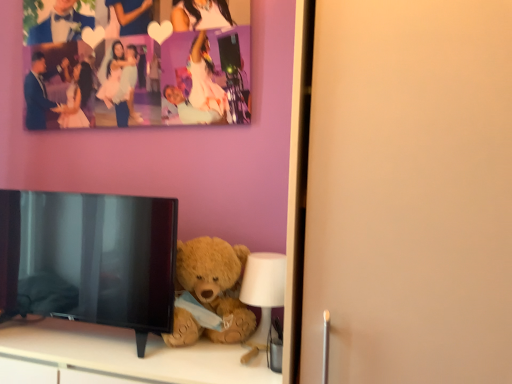
Identify the location of white plastic lamp at lower center. This screenshot has width=512, height=384. (262, 294).

Describe the element at coordinates (211, 291) in the screenshot. I see `fuzzy brown teddy bear at lower center` at that location.

What do you see at coordinates (118, 356) in the screenshot? This screenshot has width=512, height=384. I see `soft beige teddy bear at lower center` at bounding box center [118, 356].

The height and width of the screenshot is (384, 512). Find the location of `soft beige teddy bear at lower center`. soft beige teddy bear at lower center is located at coordinates (118, 356).

Identify the location of white plastic lamp at lower center. tap(262, 294).

Between soft beige teddy bear at lower center and black glossy tv at lower left, which one has larger width?

soft beige teddy bear at lower center.

From a real-world perspective, does soft beige teddy bear at lower center stand above black glossy tv at lower left?

No, from a real-world perspective, soft beige teddy bear at lower center is not over black glossy tv at lower left

Is soft beige teddy bear at lower center directly adjacent to black glossy tv at lower left?

soft beige teddy bear at lower center is not next to black glossy tv at lower left, and they're not touching.

From the image's perspective, which is below, soft beige teddy bear at lower center or black glossy tv at lower left?

soft beige teddy bear at lower center appears lower in the image.

Between fuzzy brown teddy bear at lower center and white plastic lamp at lower center, which one appears on the left side from the viewer's perspective?

From the viewer's perspective, fuzzy brown teddy bear at lower center appears more on the left side.

How far apart are fuzzy brown teddy bear at lower center and white plastic lamp at lower center?

fuzzy brown teddy bear at lower center and white plastic lamp at lower center are 4.06 inches apart.

Does point (218, 339) come farther from viewer compared to point (282, 306)?

No, (218, 339) is in front of (282, 306).

Is fuzzy brown teddy bear at lower center spatially inside white plastic lamp at lower center, or outside of it?

fuzzy brown teddy bear at lower center exists outside the volume of white plastic lamp at lower center.

Is fuzzy brown teddy bear at lower center closer to the viewer compared to soft beige teddy bear at lower center?

No, fuzzy brown teddy bear at lower center is further to the viewer.

Considering the sizes of objects fuzzy brown teddy bear at lower center and soft beige teddy bear at lower center in the image provided, who is wider, fuzzy brown teddy bear at lower center or soft beige teddy bear at lower center?

Wider between the two is soft beige teddy bear at lower center.

From the image's perspective, who appears lower, fuzzy brown teddy bear at lower center or soft beige teddy bear at lower center?

soft beige teddy bear at lower center appears lower in the image.

Considering the sizes of white plastic lamp at lower center and soft beige teddy bear at lower center in the image, is white plastic lamp at lower center wider or thinner than soft beige teddy bear at lower center?

In the image, white plastic lamp at lower center appears to be more narrow than soft beige teddy bear at lower center.

From the picture: Is white plastic lamp at lower center placed right next to soft beige teddy bear at lower center?

There is a gap between white plastic lamp at lower center and soft beige teddy bear at lower center.

From the image's perspective, is white plastic lamp at lower center located above or below soft beige teddy bear at lower center?

From the image's perspective, white plastic lamp at lower center appears above soft beige teddy bear at lower center.

From a real-world perspective, does white plastic lamp at lower center sit lower than soft beige teddy bear at lower center?

Incorrect, from a real-world perspective, white plastic lamp at lower center is higher than soft beige teddy bear at lower center.

Considering the sizes of objects soft beige teddy bear at lower center and fuzzy brown teddy bear at lower center in the image provided, who is taller, soft beige teddy bear at lower center or fuzzy brown teddy bear at lower center?

soft beige teddy bear at lower center.

Based on the photo, is soft beige teddy bear at lower center positioned far away from fuzzy brown teddy bear at lower center?

Actually, soft beige teddy bear at lower center and fuzzy brown teddy bear at lower center are a little close together.

Is soft beige teddy bear at lower center to the right of fuzzy brown teddy bear at lower center from the viewer's perspective?

In fact, soft beige teddy bear at lower center is to the left of fuzzy brown teddy bear at lower center.

Does black glossy tv at lower left have a greater height compared to soft beige teddy bear at lower center?

Indeed, black glossy tv at lower left has a greater height compared to soft beige teddy bear at lower center.

From a real-world perspective, is black glossy tv at lower left on top of soft beige teddy bear at lower center?

Yes, from a real-world perspective, black glossy tv at lower left is above soft beige teddy bear at lower center.

Is black glossy tv at lower left situated inside soft beige teddy bear at lower center or outside?

black glossy tv at lower left is outside soft beige teddy bear at lower center.

Does point (99, 202) come farther from viewer compared to point (70, 324)?

No, it is in front of (70, 324).

From the image's perspective, relative to black glossy tv at lower left, is fuzzy brown teddy bear at lower center above or below?

Based on their image positions, fuzzy brown teddy bear at lower center is located beneath black glossy tv at lower left.

Is fuzzy brown teddy bear at lower center to the right of black glossy tv at lower left from the viewer's perspective?

Yes.

Is fuzzy brown teddy bear at lower center facing towards black glossy tv at lower left?

No, fuzzy brown teddy bear at lower center does not turn towards black glossy tv at lower left.

Identify the location of furniture below the black glossy tv at lower left (from a real-world perspective). (118, 356).

At what (x,y) coordinates should I click in order to perform the action: click on lamp behind the fuzzy brown teddy bear at lower center. Please return your answer as a coordinate pair (x, y). Image resolution: width=512 pixels, height=384 pixels. Looking at the image, I should click on (262, 294).

From the image, which object appears to be nearer to black glossy tv at lower left, soft beige teddy bear at lower center or white plastic lamp at lower center?

soft beige teddy bear at lower center.

Estimate the real-world distances between objects in this image. Which object is further from fuzzy brown teddy bear at lower center, white plastic lamp at lower center or soft beige teddy bear at lower center?

The object further to fuzzy brown teddy bear at lower center is soft beige teddy bear at lower center.

Considering their positions, is soft beige teddy bear at lower center positioned closer to black glossy tv at lower left than fuzzy brown teddy bear at lower center?

soft beige teddy bear at lower center is positioned closer to the anchor black glossy tv at lower left.

When comparing their distances from soft beige teddy bear at lower center, does white plastic lamp at lower center or fuzzy brown teddy bear at lower center seem further?

The object further to soft beige teddy bear at lower center is white plastic lamp at lower center.

When comparing their distances from white plastic lamp at lower center, does black glossy tv at lower left or soft beige teddy bear at lower center seem closer?

soft beige teddy bear at lower center is positioned closer to the anchor white plastic lamp at lower center.

Based on the photo, based on their spatial positions, is black glossy tv at lower left or fuzzy brown teddy bear at lower center further from soft beige teddy bear at lower center?

fuzzy brown teddy bear at lower center is positioned further to the anchor soft beige teddy bear at lower center.

Looking at the image, which one is located closer to fuzzy brown teddy bear at lower center, white plastic lamp at lower center or black glossy tv at lower left?

Among the two, white plastic lamp at lower center is located nearer to fuzzy brown teddy bear at lower center.

From the image, which object appears to be farther from fuzzy brown teddy bear at lower center, soft beige teddy bear at lower center or white plastic lamp at lower center?

soft beige teddy bear at lower center.

Where is `furniture between black glossy tv at lower left and fuzzy brown teddy bear at lower center`? furniture between black glossy tv at lower left and fuzzy brown teddy bear at lower center is located at coordinates (118, 356).

Where is `teddy bear between black glossy tv at lower left and white plastic lamp at lower center`? The image size is (512, 384). teddy bear between black glossy tv at lower left and white plastic lamp at lower center is located at coordinates (211, 291).

You are a GUI agent. You are given a task and a screenshot of the screen. Output one action in this format:
    pyautogui.click(x=<x>, y=<y>)
    Task: Click on the teddy bear between soft beige teddy bear at lower center and white plastic lamp at lower center
    
    Given the screenshot: What is the action you would take?
    pyautogui.click(x=211, y=291)

Find the location of a particular element. Image resolution: width=512 pixels, height=384 pixels. furniture situated between black glossy tv at lower left and white plastic lamp at lower center from left to right is located at coordinates (118, 356).